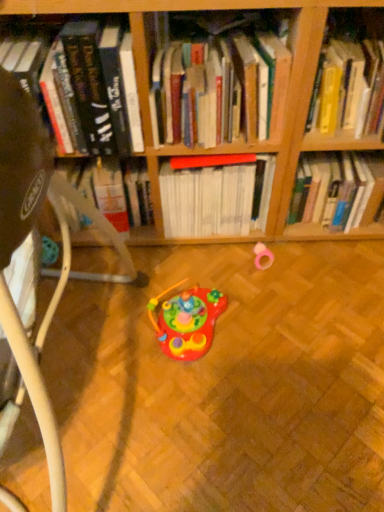
This screenshot has height=512, width=384. In order to click on free space to the left of shiny plastic toy at center, which is the first toy in left-to-right order in this screenshot , I will do `click(113, 336)`.